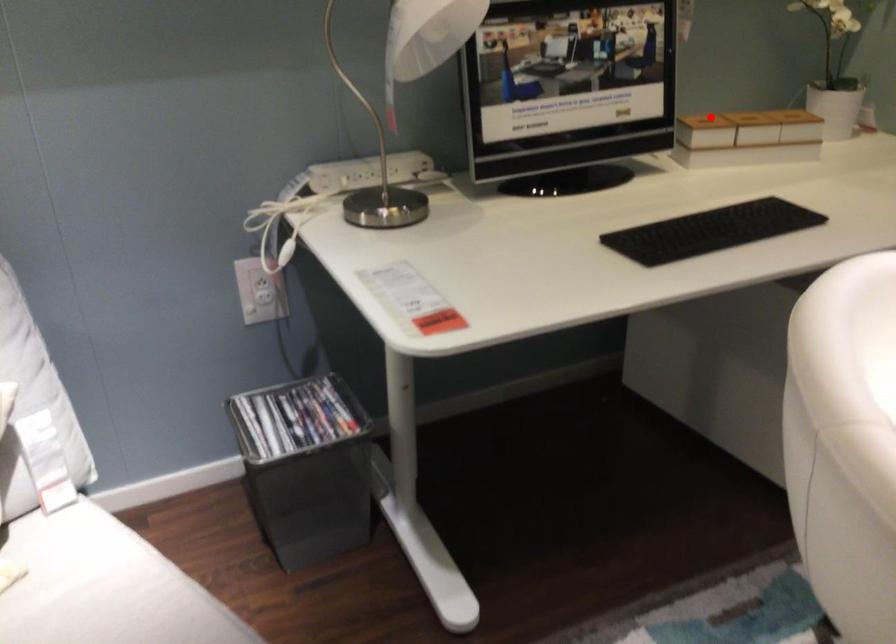
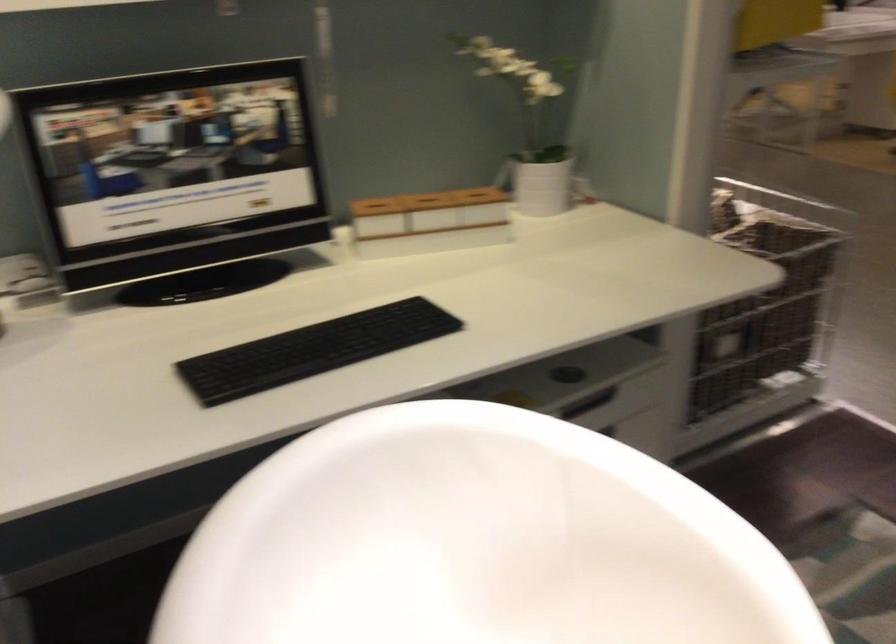
Question: I am providing you with two images of the same scene from different viewpoints. Image1 has a red point marked. In image2, the corresponding 3D location appears at what relative position? Reply with the corresponding letter.

Choices:
 (A) Closer
 (B) Farther

Answer: (A)